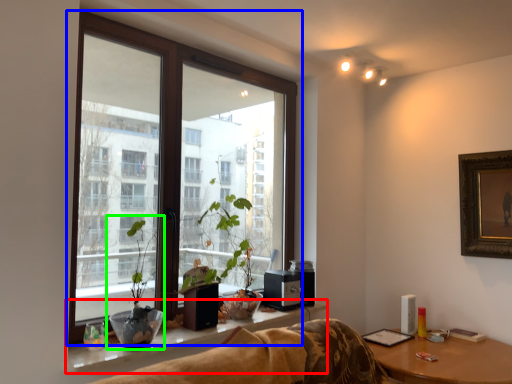
Question: Estimate the real-world distances between objects in this image. Which object is farther from window sill (highlighted by a red box), window (highlighted by a blue box) or houseplant (highlighted by a green box)?

Choices:
 (A) window
 (B) houseplant

Answer: (A)